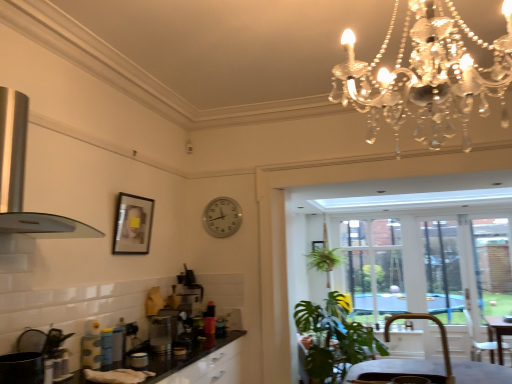
Question: Does clear glass door at center, which is the 1th window screen in left-to-right order, turn towards transparent glass door at right, which is the 1th window screen in right-to-left order?

Choices:
 (A) no
 (B) yes

Answer: (A)

Question: From the image's perspective, does clear glass door at center, which is the 1th window screen in left-to-right order, appear lower than transparent glass door at right, marked as the 3th window screen in a left-to-right arrangement?

Choices:
 (A) no
 (B) yes

Answer: (A)

Question: From a real-world perspective, is clear glass door at center, which is the 1th window screen in left-to-right order, located beneath transparent glass door at right, which is the 1th window screen in right-to-left order?

Choices:
 (A) no
 (B) yes

Answer: (A)

Question: Can we say clear glass door at center, the 3th window screen viewed from the right, lies outside transparent glass door at right, marked as the 3th window screen in a left-to-right arrangement?

Choices:
 (A) yes
 (B) no

Answer: (A)

Question: Would you say clear glass door at center, the 3th window screen viewed from the right, is a long distance from transparent glass door at right, marked as the 3th window screen in a left-to-right arrangement?

Choices:
 (A) yes
 (B) no

Answer: (A)

Question: Which is correct: green leafy plant at center is inside matte black picture frame at center, marked as the second picture frame in a front-to-back arrangement, or outside of it?

Choices:
 (A) inside
 (B) outside

Answer: (B)

Question: Does point (330, 296) appear closer or farther from the camera than point (315, 241)?

Choices:
 (A) farther
 (B) closer

Answer: (B)

Question: From the image's perspective, is green leafy plant at center above or below matte black picture frame at center, marked as the second picture frame in a front-to-back arrangement?

Choices:
 (A) above
 (B) below

Answer: (B)

Question: Considering the positions of green leafy plant at center and matte black picture frame at center, the second picture frame when ordered from left to right, in the image, is green leafy plant at center wider or thinner than matte black picture frame at center, the second picture frame when ordered from left to right,?

Choices:
 (A) wide
 (B) thin

Answer: (A)

Question: From the image's perspective, is silver metallic clock at center located above or below transparent glass window at center, the 2th window screen in the left-to-right sequence?

Choices:
 (A) above
 (B) below

Answer: (A)

Question: Which is correct: silver metallic clock at center is inside transparent glass window at center, placed as the 2th window screen when sorted from right to left, or outside of it?

Choices:
 (A) inside
 (B) outside

Answer: (B)

Question: Considering the positions of point (210, 210) and point (457, 279), is point (210, 210) closer or farther from the camera than point (457, 279)?

Choices:
 (A) farther
 (B) closer

Answer: (B)

Question: Based on their positions, is silver metallic clock at center located to the left or right of transparent glass window at center, the 2th window screen in the left-to-right sequence?

Choices:
 (A) right
 (B) left

Answer: (B)

Question: Is green leafy plant at center wider or thinner than satin silver toaster at center?

Choices:
 (A) thin
 (B) wide

Answer: (B)

Question: Which is correct: green leafy plant at center is inside satin silver toaster at center, or outside of it?

Choices:
 (A) outside
 (B) inside

Answer: (A)